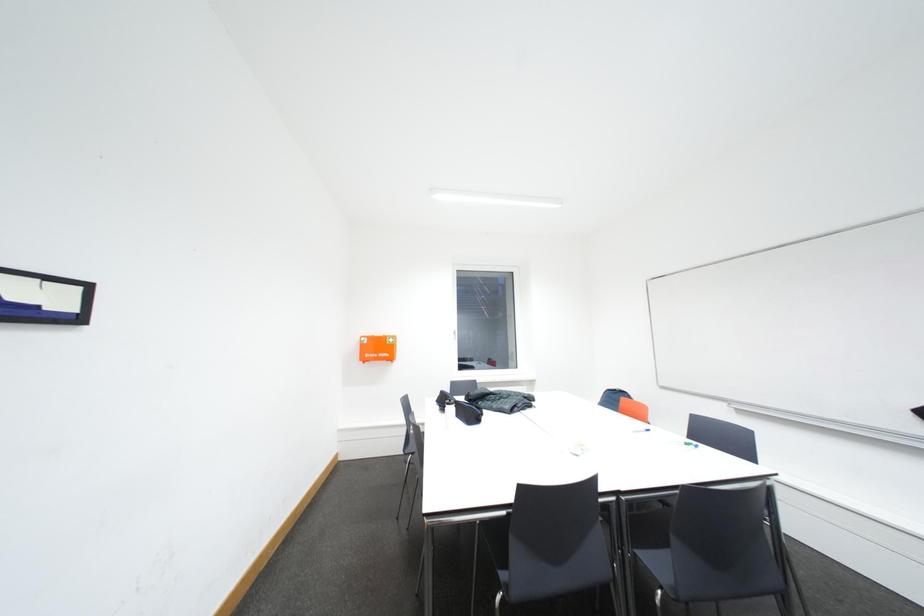
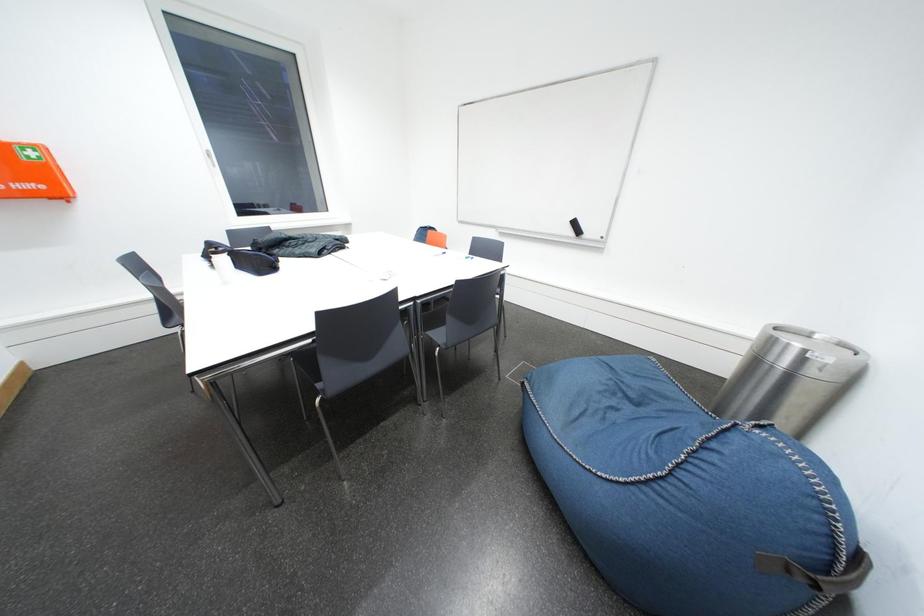
First-person continuous shooting, in which direction is the camera rotating?

The camera's rotation is toward right-down.